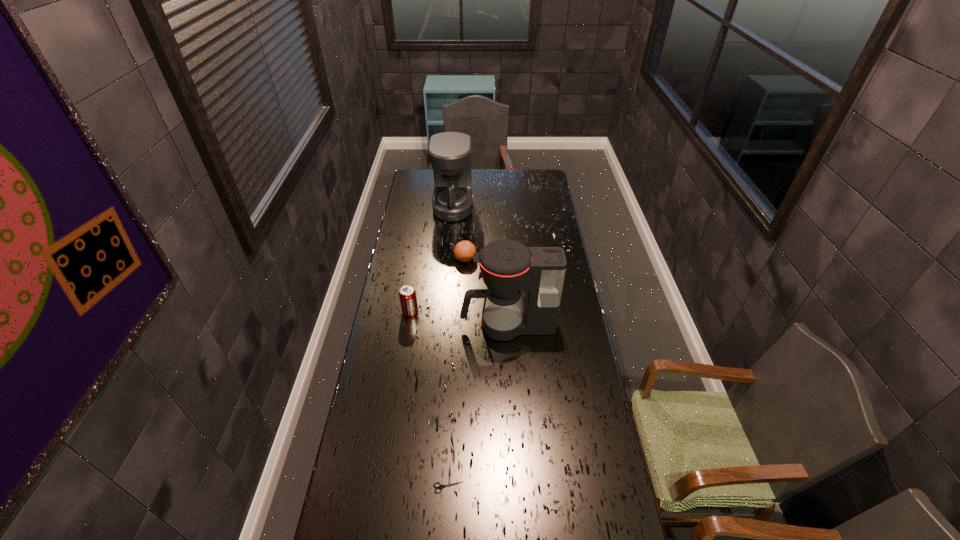
At what (x,y) coordinates should I click in order to perform the action: click on vacant space located pour from the carafe of the nearer coffee maker. Please return your answer as a coordinate pair (x, y). This screenshot has width=960, height=540. Looking at the image, I should click on (436, 325).

Locate an element on the screen. vacant region located 0.330m on the button side of the farther coffee maker is located at coordinates (535, 207).

This screenshot has height=540, width=960. Identify the location of vacant space located 0.130m on the right of the leftmost object. (450, 312).

Find the location of `free space located 0.350m on the front of the clementine`. free space located 0.350m on the front of the clementine is located at coordinates (463, 323).

At what (x,y) coordinates should I click in order to perform the action: click on blank area located 0.090m on the right of the shortest object. Please return your answer as a coordinate pair (x, y). The image size is (960, 540). Looking at the image, I should click on (494, 488).

Where is `coffee maker present at the left edge`? coffee maker present at the left edge is located at coordinates (450, 153).

The height and width of the screenshot is (540, 960). In order to click on soda can that is positioned at the left edge in this screenshot , I will do `click(407, 294)`.

You are a GUI agent. You are given a task and a screenshot of the screen. Output one action in this format:
    pyautogui.click(x=<x>, y=<y>)
    Task: Click on the object that is at the right edge
    
    Given the screenshot: What is the action you would take?
    pyautogui.click(x=507, y=267)

In the image, there is a desktop. What are the coordinates of `vacant space at the left edge` in the screenshot? It's located at 376,418.

In the image, there is a desktop. Where is `vacant space at the right edge`? vacant space at the right edge is located at coordinates (588, 445).